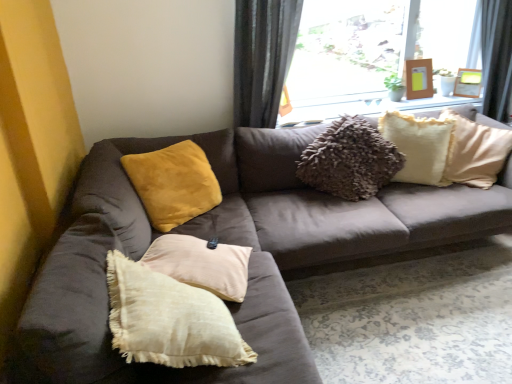
The image size is (512, 384). Describe the element at coordinates (228, 243) in the screenshot. I see `suede brown couch at center` at that location.

Image resolution: width=512 pixels, height=384 pixels. Describe the element at coordinates (419, 79) in the screenshot. I see `wooden picture frame at upper right, which ranks as the 1th picture frame in left-to-right order` at that location.

Measure the distance between fuzzy cream pillow at upper right, which is the 2th pillow in left-to-right order, and camera.

8.24 feet.

Measure the distance between wooden frame at upper center and camera.

wooden frame at upper center and camera are 8.96 feet apart.

Find the location of a particular element. This screenshot has height=384, width=512. wooden picture frame at upper right, which ranks as the first picture frame in right-to-left order is located at coordinates click(x=468, y=83).

The image size is (512, 384). What do you see at coordinates (468, 83) in the screenshot? I see `wooden picture frame at upper right, which ranks as the first picture frame in right-to-left order` at bounding box center [468, 83].

Identify the location of velvet yellow pillow at upper left, the 1th pillow when ordered from left to right. (173, 183).

Which is more to the right, fuzzy cream pillow at upper right, which is the 1th pillow from right to left, or velvet yellow pillow at upper left, marked as the 2th pillow in a right-to-left arrangement?

From the viewer's perspective, fuzzy cream pillow at upper right, which is the 1th pillow from right to left, appears more on the right side.

Is fuzzy cream pillow at upper right, which is the 1th pillow from right to left, oriented towards velvet yellow pillow at upper left, marked as the 2th pillow in a right-to-left arrangement?

No, fuzzy cream pillow at upper right, which is the 1th pillow from right to left, is not turned towards velvet yellow pillow at upper left, marked as the 2th pillow in a right-to-left arrangement.

Is fuzzy cream pillow at upper right, which is the 2th pillow in left-to-right order, placed right next to velvet yellow pillow at upper left, the 1th pillow when ordered from left to right?

No, fuzzy cream pillow at upper right, which is the 2th pillow in left-to-right order, is not making contact with velvet yellow pillow at upper left, the 1th pillow when ordered from left to right.

Can we say fuzzy cream pillow at upper right, which is the 1th pillow from right to left, lies outside velvet yellow pillow at upper left, the 1th pillow when ordered from left to right?

Yes, fuzzy cream pillow at upper right, which is the 1th pillow from right to left, is not within velvet yellow pillow at upper left, the 1th pillow when ordered from left to right.

Does wooden picture frame at upper right, which appears as the second picture frame when viewed from the left, lie behind suede brown couch at center?

Yes, wooden picture frame at upper right, which appears as the second picture frame when viewed from the left, is further from the viewer.

Does wooden picture frame at upper right, which ranks as the first picture frame in right-to-left order, have a lesser height compared to suede brown couch at center?

Yes.

Does wooden picture frame at upper right, which appears as the second picture frame when viewed from the left, have a larger size compared to suede brown couch at center?

Incorrect, wooden picture frame at upper right, which appears as the second picture frame when viewed from the left, is not larger than suede brown couch at center.

Which is less distant, (479, 77) or (55, 363)?

Point (479, 77).

Which of these two, wooden frame at upper center or velvet yellow pillow at upper left, marked as the 2th pillow in a right-to-left arrangement, is bigger?

With larger size is velvet yellow pillow at upper left, marked as the 2th pillow in a right-to-left arrangement.

From the image's perspective, is wooden frame at upper center above or below velvet yellow pillow at upper left, the 1th pillow when ordered from left to right?

Clearly, from the image's perspective, wooden frame at upper center is above velvet yellow pillow at upper left, the 1th pillow when ordered from left to right.

From a real-world perspective, which is physically below, wooden frame at upper center or velvet yellow pillow at upper left, marked as the 2th pillow in a right-to-left arrangement?

In real-world perspective, velvet yellow pillow at upper left, marked as the 2th pillow in a right-to-left arrangement, is lower.

Considering the relative sizes of wooden frame at upper center and velvet yellow pillow at upper left, marked as the 2th pillow in a right-to-left arrangement, in the image provided, is wooden frame at upper center wider than velvet yellow pillow at upper left, marked as the 2th pillow in a right-to-left arrangement,?

No, wooden frame at upper center is not wider than velvet yellow pillow at upper left, marked as the 2th pillow in a right-to-left arrangement.

Between wooden picture frame at upper right, the second picture frame when ordered from right to left, and fuzzy cream pillow at upper right, which is the 1th pillow from right to left, which one appears on the right side from the viewer's perspective?

wooden picture frame at upper right, the second picture frame when ordered from right to left.

Is wooden picture frame at upper right, the second picture frame when ordered from right to left, positioned with its back to fuzzy cream pillow at upper right, which is the 1th pillow from right to left?

No, wooden picture frame at upper right, the second picture frame when ordered from right to left, is not facing away from fuzzy cream pillow at upper right, which is the 1th pillow from right to left.

From a real-world perspective, which is physically below, wooden picture frame at upper right, the second picture frame when ordered from right to left, or fuzzy cream pillow at upper right, which is the 2th pillow in left-to-right order?

fuzzy cream pillow at upper right, which is the 2th pillow in left-to-right order, is physically lower.

Which is further, [416,60] or [423,133]?

The point [416,60] is behind.

Is fuzzy cream pillow at upper right, which is the 2th pillow in left-to-right order, aimed at transparent glass window at upper center?

No, fuzzy cream pillow at upper right, which is the 2th pillow in left-to-right order, is not oriented towards transparent glass window at upper center.

How many degrees apart are the facing directions of fuzzy cream pillow at upper right, which is the 2th pillow in left-to-right order, and transparent glass window at upper center?

They differ by 15.2 degrees in their facing directions.

From a real-world perspective, is fuzzy cream pillow at upper right, which is the 1th pillow from right to left, physically below transparent glass window at upper center?

Yes, from a real-world perspective, fuzzy cream pillow at upper right, which is the 1th pillow from right to left, is under transparent glass window at upper center.

Locate an element on the screen. window on the left of fuzzy cream pillow at upper right, which is the 1th pillow from right to left is located at coordinates (377, 54).

Is transparent glass window at upper center spatially inside suede brown couch at center, or outside of it?

transparent glass window at upper center is located beyond the bounds of suede brown couch at center.

How different are the orientations of transparent glass window at upper center and suede brown couch at center in degrees?

The angle between the facing direction of transparent glass window at upper center and the facing direction of suede brown couch at center is 1.66e-05 degrees.

Between transparent glass window at upper center and suede brown couch at center, which one has larger width?

suede brown couch at center.

Is transparent glass window at upper center facing towards suede brown couch at center?

Yes, transparent glass window at upper center faces towards suede brown couch at center.

Is transparent glass window at upper center inside the boundaries of wooden frame at upper center, or outside?

transparent glass window at upper center is spatially situated outside wooden frame at upper center.

At what (x,y) coordinates should I click in order to perform the action: click on window sill lying below the transparent glass window at upper center (from the image's perspective). Please return your answer as a coordinate pair (x, y). The width and height of the screenshot is (512, 384). Looking at the image, I should click on (366, 106).

Is transparent glass window at upper center positioned in front of wooden frame at upper center?

Yes, the depth of transparent glass window at upper center is less than that of wooden frame at upper center.

Does transparent glass window at upper center have a lesser width compared to wooden frame at upper center?

No.

The height and width of the screenshot is (384, 512). I want to click on pillow that appears behind the velvet yellow pillow at upper left, marked as the 2th pillow in a right-to-left arrangement, so point(418,146).

In order to click on studio couch lying below the wooden picture frame at upper right, which ranks as the first picture frame in right-to-left order (from the image's perspective) in this screenshot , I will do `click(228, 243)`.

Estimate the real-world distances between objects in this image. Which object is further from velvet yellow pillow at upper left, marked as the 2th pillow in a right-to-left arrangement, wooden frame at upper center or transparent glass window at upper center?

The object further to velvet yellow pillow at upper left, marked as the 2th pillow in a right-to-left arrangement, is transparent glass window at upper center.

Estimate the real-world distances between objects in this image. Which object is further from fuzzy cream pillow at upper right, which is the 1th pillow from right to left, velvet yellow pillow at upper left, marked as the 2th pillow in a right-to-left arrangement, or suede brown couch at center?

Based on the image, velvet yellow pillow at upper left, marked as the 2th pillow in a right-to-left arrangement, appears to be further to fuzzy cream pillow at upper right, which is the 1th pillow from right to left.

Based on their spatial positions, is wooden frame at upper center or suede brown couch at center further from velvet yellow pillow at upper left, the 1th pillow when ordered from left to right?

wooden frame at upper center.

Based on their spatial positions, is fuzzy cream pillow at upper right, which is the 1th pillow from right to left, or wooden frame at upper center further from transparent glass window at upper center?

fuzzy cream pillow at upper right, which is the 1th pillow from right to left, is positioned further to the anchor transparent glass window at upper center.

Which object lies nearer to the anchor point fuzzy cream pillow at upper right, which is the 2th pillow in left-to-right order, wooden frame at upper center or transparent glass window at upper center?

wooden frame at upper center lies closer to fuzzy cream pillow at upper right, which is the 2th pillow in left-to-right order, than the other object.

From the image, which object appears to be nearer to wooden picture frame at upper right, which ranks as the first picture frame in right-to-left order, fuzzy cream pillow at upper right, which is the 1th pillow from right to left, or wooden frame at upper center?

wooden frame at upper center is closer to wooden picture frame at upper right, which ranks as the first picture frame in right-to-left order.

Considering their positions, is velvet yellow pillow at upper left, marked as the 2th pillow in a right-to-left arrangement, positioned closer to wooden frame at upper center than gray fabric curtain at upper center?

gray fabric curtain at upper center lies closer to wooden frame at upper center than the other object.

Considering their positions, is transparent glass window at upper center positioned further to suede brown couch at center than wooden frame at upper center?

The object further to suede brown couch at center is transparent glass window at upper center.

Image resolution: width=512 pixels, height=384 pixels. I want to click on curtain between suede brown couch at center and fuzzy cream pillow at upper right, which is the 1th pillow from right to left, along the z-axis, so click(x=262, y=58).

You are a GUI agent. You are given a task and a screenshot of the screen. Output one action in this format:
    pyautogui.click(x=<x>, y=<y>)
    Task: Click on the window positioned between suede brown couch at center and wooden frame at upper center from near to far
    The image size is (512, 384).
    Given the screenshot: What is the action you would take?
    pyautogui.click(x=377, y=54)

This screenshot has height=384, width=512. What are the coordinates of `pillow between velvet yellow pillow at upper left, the 1th pillow when ordered from left to right, and wooden picture frame at upper right, the second picture frame when ordered from right to left` in the screenshot? It's located at (418, 146).

Identify the location of picture frame located between transparent glass window at upper center and wooden picture frame at upper right, which ranks as the first picture frame in right-to-left order, in the left-right direction. (419, 79).